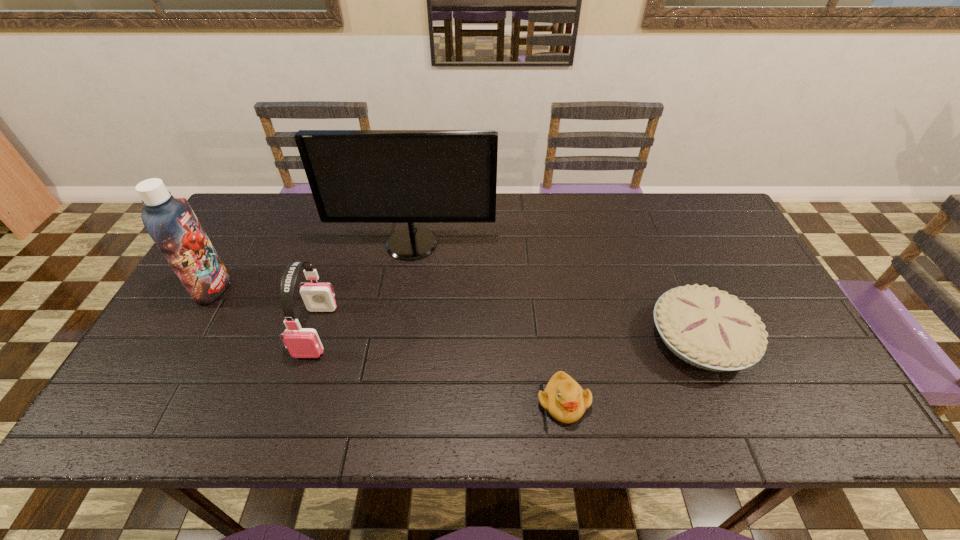
The height and width of the screenshot is (540, 960). Find the location of `unoccupied area between the pie and the leftmost object`. unoccupied area between the pie and the leftmost object is located at coordinates click(x=457, y=313).

Where is `vacant space in between the earphone and the duckling`? vacant space in between the earphone and the duckling is located at coordinates (440, 367).

Locate an element on the screen. The image size is (960, 540). free space between the third tallest object and the fourth object from left to right is located at coordinates (440, 367).

Identify the location of free area in between the farthest object and the rightmost object. Image resolution: width=960 pixels, height=540 pixels. (556, 291).

This screenshot has height=540, width=960. I want to click on free space between the farthest object and the fourth object from left to right, so click(x=488, y=323).

Where is `empty space between the duckling and the earphone`? This screenshot has height=540, width=960. empty space between the duckling and the earphone is located at coordinates (440, 367).

In order to click on unoccupied position between the rightmost object and the shampoo in this screenshot , I will do (x=457, y=313).

You are a GUI agent. You are given a task and a screenshot of the screen. Output one action in this format:
    pyautogui.click(x=<x>, y=<y>)
    Task: Click on the object that can be found as the third closest to the computer monitor
    The width and height of the screenshot is (960, 540).
    Given the screenshot: What is the action you would take?
    pyautogui.click(x=563, y=397)

Locate which object is the fourth closest to the computer monitor. Please provide its 2D coordinates. Your answer should be formatted as a tuple, i.e. [(x, y)], where the tuple contains the x and y coordinates of a point satisfying the conditions above.

[(705, 327)]

This screenshot has height=540, width=960. Identify the location of vacant space that satisfies the following two spatial constraints: 1. on the front-facing side of the farthest object; 2. on the left side of the pie. (396, 338).